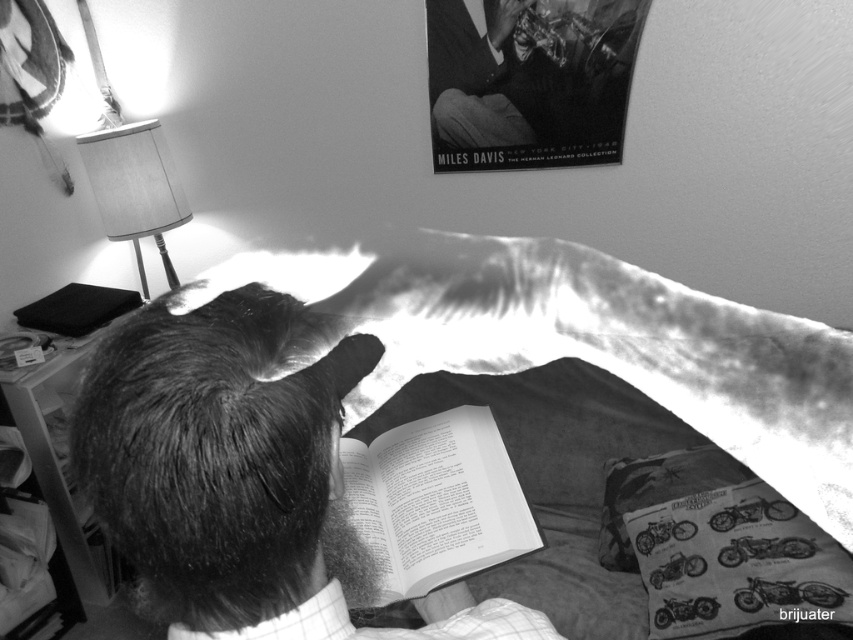
Can you confirm if paperback book at center is smaller than matte fabric lampshade at upper left?

Yes, paperback book at center is smaller than matte fabric lampshade at upper left.

This screenshot has width=853, height=640. Describe the element at coordinates (425, 508) in the screenshot. I see `paperback book at center` at that location.

Identify the location of paperback book at center. (425, 508).

Is metallic paper miles davis poster at upper center taller than printed paper book at lower center?

Correct, metallic paper miles davis poster at upper center is much taller as printed paper book at lower center.

Does point (463, 72) lie in front of point (798, 563)?

No, it is not.

This screenshot has height=640, width=853. In order to click on metallic paper miles davis poster at upper center in this screenshot , I will do `click(529, 81)`.

Which is below, dark hair at center or printed paper book at lower center?

printed paper book at lower center

In the scene shown: Can you confirm if dark hair at center is positioned below printed paper book at lower center?

Incorrect, dark hair at center is not positioned below printed paper book at lower center.

Which is in front, point (173, 589) or point (717, 596)?

Positioned in front is point (173, 589).

Where is `dark hair at center`? Image resolution: width=853 pixels, height=640 pixels. dark hair at center is located at coordinates (234, 477).